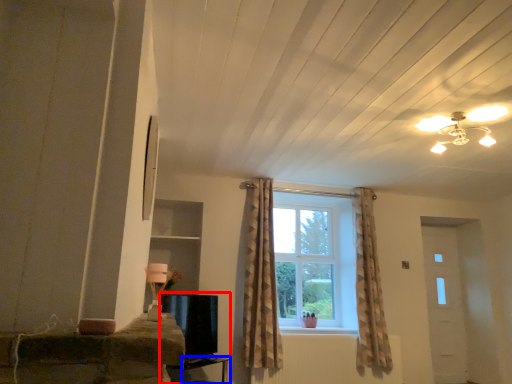
Question: Which of the following is the farthest to the observer, entertainment center (highlighted by a red box) or table (highlighted by a blue box)?

Choices:
 (A) entertainment center
 (B) table

Answer: (A)